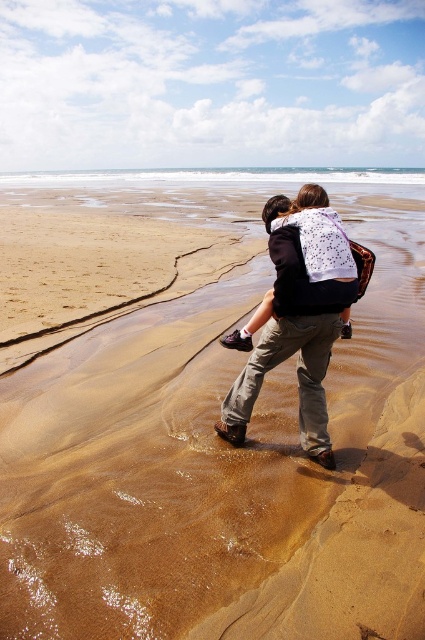
You are standing at the point marked as point (299,317) on the beach. Looking around, you see a matte black hoodie at center. What is the nearest object to you?

The nearest object to you is the matte black hoodie at center because the point (299,317) is on it.

You are standing on the beach and want to walk towards the clear water at center. Which direction should you move relative to the brown sand at center?

You should move upwards from the brown sand at center to reach the clear water at center because the brown sand at center is located below clear water at center.

You are standing at the edge of the beach facing the ocean. There is a point marked at coordinates (223,468). What type of terrain is located at that point?

The point at (223,468) marks brown sand at center.